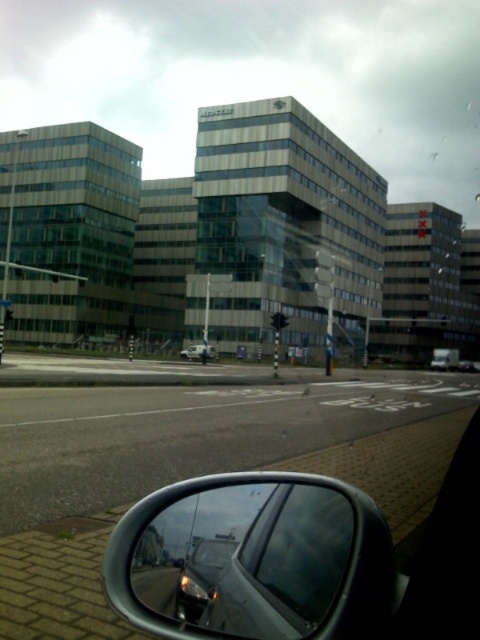
Question: Does shiny silver mirror at lower right appear on the right side of transparent glass car window at lower center?

Choices:
 (A) yes
 (B) no

Answer: (A)

Question: From the image, what is the correct spatial relationship of shiny silver mirror at lower right in relation to transparent glass car window at lower center?

Choices:
 (A) above
 (B) below

Answer: (B)

Question: Which point is farther to the camera?

Choices:
 (A) metallic silver car at center
 (B) shiny silver mirror at lower right
 (C) transparent glass car window at lower center

Answer: (A)

Question: Which of the following is the farthest from the observer?

Choices:
 (A) transparent glass car window at lower center
 (B) shiny silver mirror at lower right
 (C) metallic silver car at center

Answer: (C)

Question: Observing the image, what is the correct spatial positioning of transparent glass car window at lower center in reference to metallic silver car at center?

Choices:
 (A) below
 (B) above

Answer: (B)

Question: Which object appears closest to the camera in this image?

Choices:
 (A) shiny silver mirror at lower right
 (B) metallic silver car at center

Answer: (A)